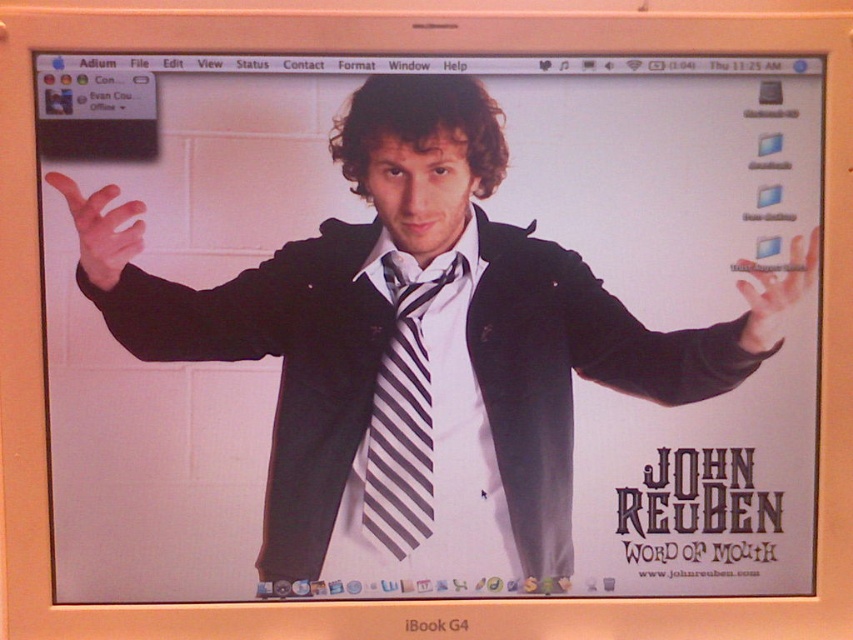
Question: Can you confirm if black striped tie at center is positioned below matte black hand at right?

Choices:
 (A) yes
 (B) no

Answer: (A)

Question: Which point is farther to the camera?

Choices:
 (A) matte black hand at left
 (B) matte black hand at right

Answer: (B)

Question: Which point appears farthest from the camera in this image?

Choices:
 (A) (77, 195)
 (B) (416, 515)

Answer: (B)

Question: Does black striped tie at center appear on the left side of matte black hand at left?

Choices:
 (A) yes
 (B) no

Answer: (B)

Question: Which object appears closest to the camera in this image?

Choices:
 (A) matte black hand at right
 (B) matte black hand at left

Answer: (B)

Question: Is matte black hand at left positioned before matte black hand at right?

Choices:
 (A) yes
 (B) no

Answer: (A)